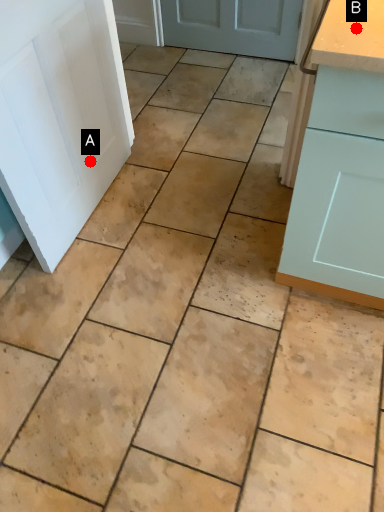
Question: Two points are circled on the image, labeled by A and B beside each circle. Among these points, which one is nearest to the camera?

Choices:
 (A) A is closer
 (B) B is closer

Answer: (B)